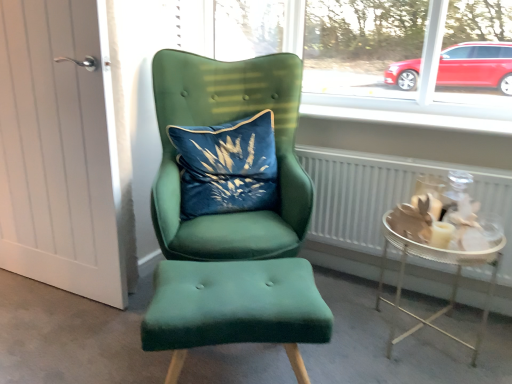
The height and width of the screenshot is (384, 512). In order to click on vacant area that is in front of white wood door at left in this screenshot , I will do `click(42, 324)`.